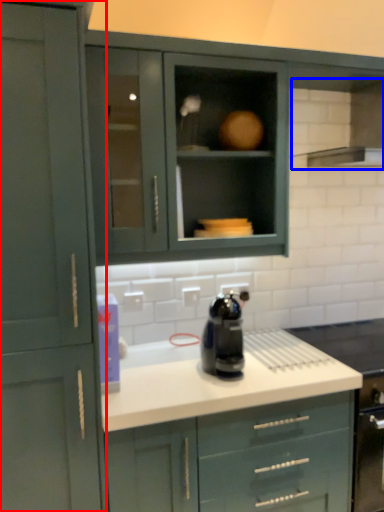
Question: Which object is closer to the camera taking this photo, cabinetry (highlighted by a red box) or exhaust hood (highlighted by a blue box)?

Choices:
 (A) cabinetry
 (B) exhaust hood

Answer: (A)